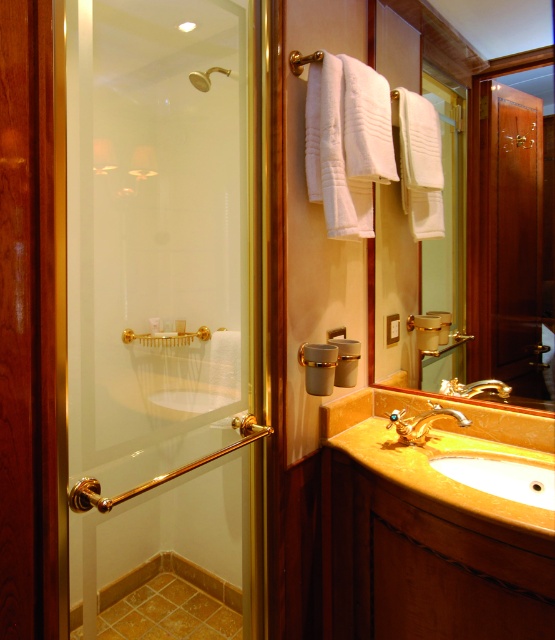
You are designing a bathroom layout and need to ensure that the matte gold mirror at center and the gold metallic faucet at sink right are visible from the entrance. Given their heights, which object will appear taller when viewed from the entrance?

The matte gold mirror at center appears taller than the gold metallic faucet at sink right because it has a greater height.

You are a designer planning to install a new faucet on the yellow marble sink at lower center. The faucet you chose is 15 cm in height. Considering the height of the matte gold showerhead at upper left, will the faucet fit without exceeding the sink height?

The yellow marble sink at lower center is taller than the matte gold showerhead at upper left. Since the faucet is only 15 cm tall, it should fit without exceeding the sink height, provided the showerhead isn not taller than 15 cm. However, since the sink is taller than the showerhead, and the faucet is 15 cm, the faucet will be shorter than the sink, so it should fit.